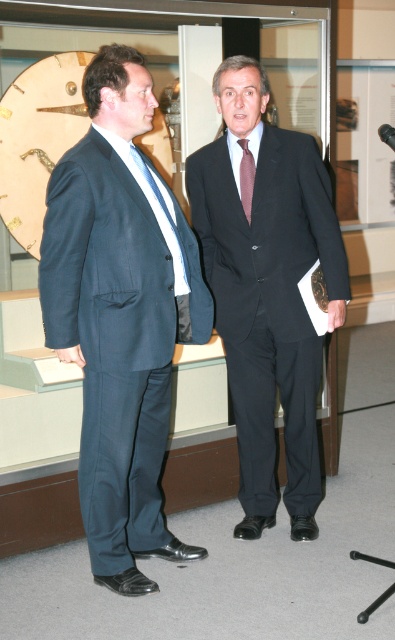
Identify the location of black matte suit at center. (267, 291).

Which is more to the left, black matte suit at center or purple silk tie at center?

Positioned to the left is purple silk tie at center.

Is point (223, 74) positioned behind point (250, 164)?

No, (223, 74) is closer to viewer.

Where is `black matte suit at center`? This screenshot has width=395, height=640. black matte suit at center is located at coordinates (267, 291).

Looking at this image, is matte blue suit at left positioned before purple silk tie at center?

Yes.

Can you confirm if matte blue suit at left is smaller than purple silk tie at center?

No.

What do you see at coordinates (120, 316) in the screenshot? Image resolution: width=395 pixels, height=640 pixels. I see `matte blue suit at left` at bounding box center [120, 316].

Locate an element on the screen. matte blue suit at left is located at coordinates tap(120, 316).

Identify the location of matte blue suit at left. (120, 316).

Is matte blue suit at left thinner than black matte suit at center?

Indeed, matte blue suit at left has a lesser width compared to black matte suit at center.

Find the location of `matte blue suit at left`. matte blue suit at left is located at coordinates (120, 316).